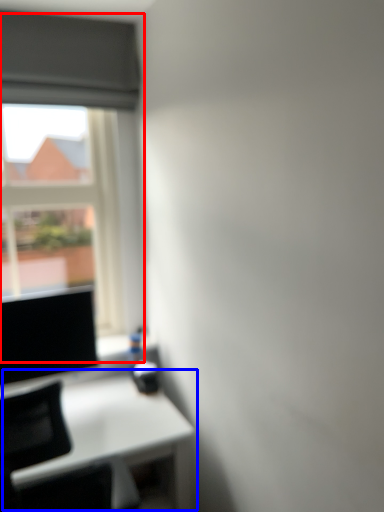
Question: Which object appears farthest to the camera in this image, window (highlighted by a red box) or table (highlighted by a blue box)?

Choices:
 (A) window
 (B) table

Answer: (A)